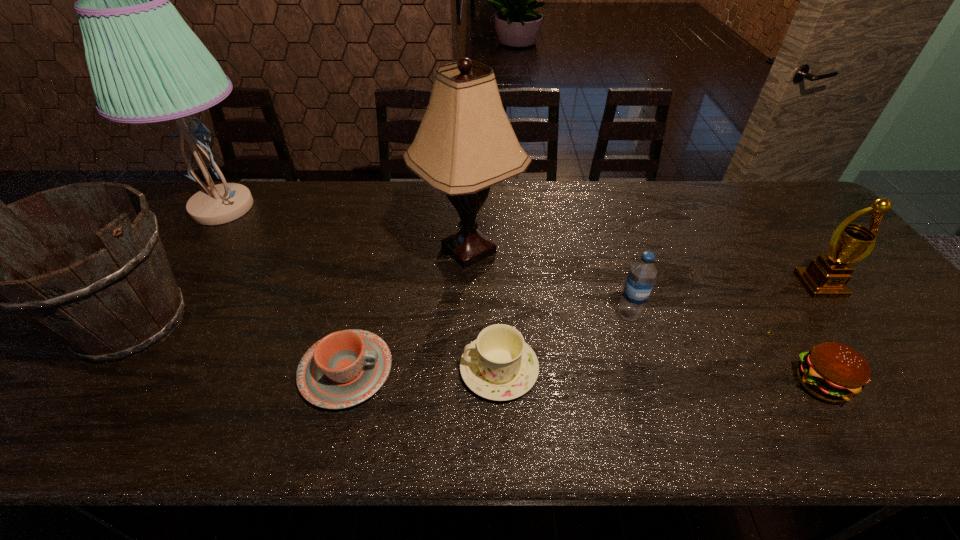
This screenshot has height=540, width=960. What are the coordinates of `vacant area situated 0.380m on the handle side of the sixth object from right to left` in the screenshot? It's located at (562, 371).

At what (x,y) coordinates should I click in order to perform the action: click on hamburger situated at the near edge. Please return your answer as a coordinate pair (x, y). The width and height of the screenshot is (960, 540). Looking at the image, I should click on (834, 372).

Identify the location of lamp present at the left edge. The image size is (960, 540). coord(146,65).

This screenshot has height=540, width=960. Find the location of `bucket situated at the left edge`. bucket situated at the left edge is located at coordinates (117, 298).

Where is `object that is at the right edge`? The height and width of the screenshot is (540, 960). object that is at the right edge is located at coordinates (826, 277).

This screenshot has width=960, height=540. What are the coordinates of `object that is positioned at the far left corner` in the screenshot? It's located at (146, 65).

You are a GUI agent. You are given a task and a screenshot of the screen. Output one action in this format:
    pyautogui.click(x=<x>, y=<y>)
    Task: Click on the free spot at the far edge of the desktop
    This screenshot has width=960, height=540.
    Given the screenshot: What is the action you would take?
    pyautogui.click(x=382, y=184)

In the image, there is a desktop. Identify the location of free space at the near edge. The height and width of the screenshot is (540, 960). (290, 413).

I want to click on vacant space at the right edge of the desktop, so click(875, 293).

The width and height of the screenshot is (960, 540). I want to click on blank region between the sixth object from left to right and the right lamp, so (x=549, y=282).